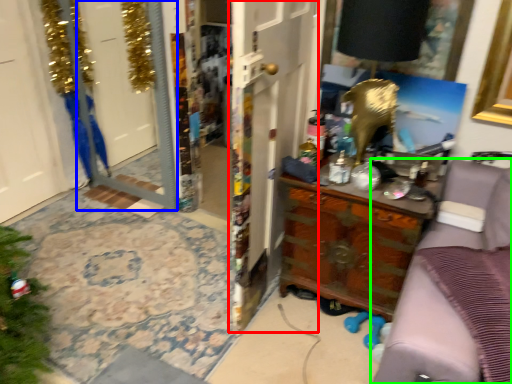
Question: Considering the real-world distances, which object is closest to door (highlighted by a red box)? screen door (highlighted by a blue box) or furniture (highlighted by a green box).

Choices:
 (A) screen door
 (B) furniture

Answer: (B)